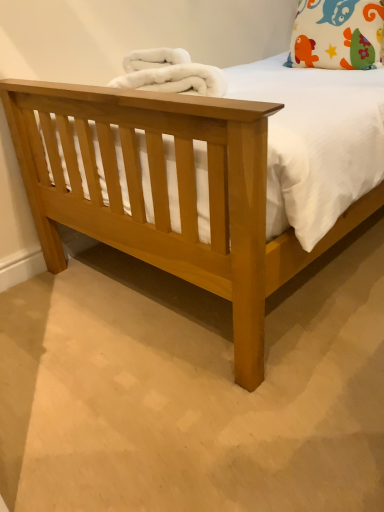
Question: Does white fabric pillow with colorful patterns at upper right have a lesser width compared to white fluffy blanket at upper center?

Choices:
 (A) yes
 (B) no

Answer: (A)

Question: Considering the relative positions of white fabric pillow with colorful patterns at upper right and white fluffy blanket at upper center in the image provided, is white fabric pillow with colorful patterns at upper right to the left of white fluffy blanket at upper center from the viewer's perspective?

Choices:
 (A) no
 (B) yes

Answer: (A)

Question: Could white fluffy blanket at upper center be considered to be inside white fabric pillow with colorful patterns at upper right?

Choices:
 (A) yes
 (B) no

Answer: (B)

Question: Is white fabric pillow with colorful patterns at upper right closer to the viewer compared to white fluffy blanket at upper center?

Choices:
 (A) yes
 (B) no

Answer: (B)

Question: Considering the relative sizes of white fabric pillow with colorful patterns at upper right and white fluffy blanket at upper center in the image provided, is white fabric pillow with colorful patterns at upper right taller than white fluffy blanket at upper center?

Choices:
 (A) yes
 (B) no

Answer: (A)

Question: Is white fabric pillow with colorful patterns at upper right wider than white fluffy blanket at upper center?

Choices:
 (A) no
 (B) yes

Answer: (A)

Question: Does white fluffy blanket at upper center turn towards white fabric pillow with colorful patterns at upper right?

Choices:
 (A) yes
 (B) no

Answer: (B)

Question: Is white fluffy blanket at upper center next to white fabric pillow with colorful patterns at upper right?

Choices:
 (A) yes
 (B) no

Answer: (B)

Question: Considering the relative positions of white fluffy blanket at upper center and white fabric pillow with colorful patterns at upper right in the image provided, is white fluffy blanket at upper center to the left of white fabric pillow with colorful patterns at upper right from the viewer's perspective?

Choices:
 (A) yes
 (B) no

Answer: (A)

Question: Is the position of white fluffy blanket at upper center more distant than that of white fabric pillow with colorful patterns at upper right?

Choices:
 (A) no
 (B) yes

Answer: (A)

Question: Is white fluffy blanket at upper center in front of white fabric pillow with colorful patterns at upper right?

Choices:
 (A) yes
 (B) no

Answer: (A)

Question: Is white fluffy blanket at upper center outside white fabric pillow with colorful patterns at upper right?

Choices:
 (A) no
 (B) yes

Answer: (B)

Question: From the image's perspective, is white fluffy blanket at upper center above or below white fabric pillow with colorful patterns at upper right?

Choices:
 (A) above
 (B) below

Answer: (B)